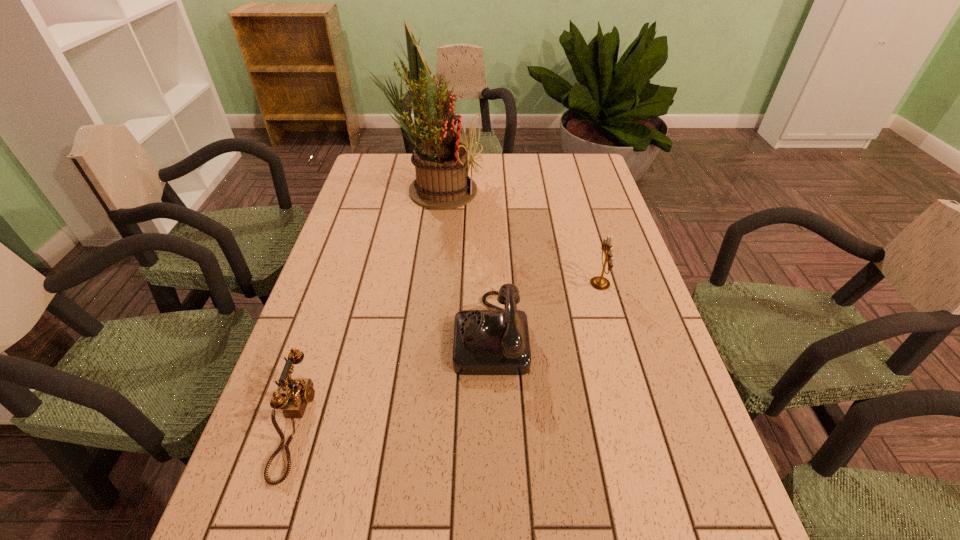
Locate an element on the screen. free space at the right edge of the desktop is located at coordinates (594, 259).

You are a GUI agent. You are given a task and a screenshot of the screen. Output one action in this format:
    pyautogui.click(x=<x>, y=<y>)
    Task: Click on the blank space at the far left corner of the desktop
    
    Given the screenshot: What is the action you would take?
    pyautogui.click(x=367, y=171)

The image size is (960, 540). Find the location of `vacant area that lies between the shorter telephone and the right telephone`. vacant area that lies between the shorter telephone and the right telephone is located at coordinates (393, 379).

Where is `empty location between the flower arrangement and the shorter telephone`? This screenshot has height=540, width=960. empty location between the flower arrangement and the shorter telephone is located at coordinates (365, 307).

What are the coordinates of `vacant space in between the shortest object and the tallest object` in the screenshot? It's located at (365, 307).

The width and height of the screenshot is (960, 540). In order to click on free area in between the candelabrum and the leftmost object in this screenshot , I will do `click(447, 354)`.

You are a GUI agent. You are given a task and a screenshot of the screen. Output one action in this format:
    pyautogui.click(x=<x>, y=<y>)
    Task: Click on the vacant region between the second tallest object and the right telephone
    The height and width of the screenshot is (540, 960).
    Given the screenshot: What is the action you would take?
    pyautogui.click(x=545, y=308)

Find the location of a particular element. This screenshot has width=960, height=540. free space between the third shortest object and the shorter telephone is located at coordinates (447, 354).

Identify the location of free space between the right telephone and the shorter telephone. This screenshot has height=540, width=960. (393, 379).

Locate an element on the screen. The height and width of the screenshot is (540, 960). free spot between the right telephone and the flower arrangement is located at coordinates (463, 261).